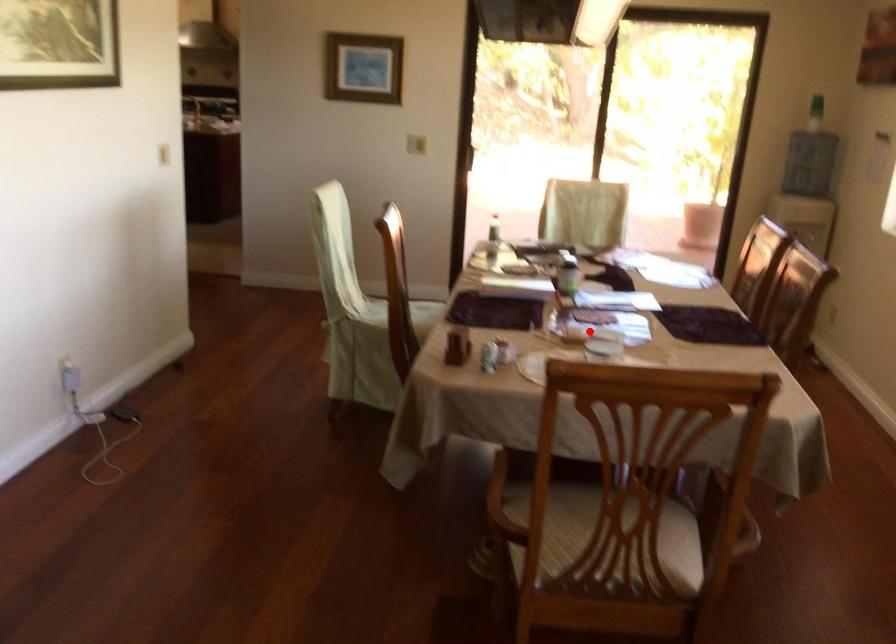
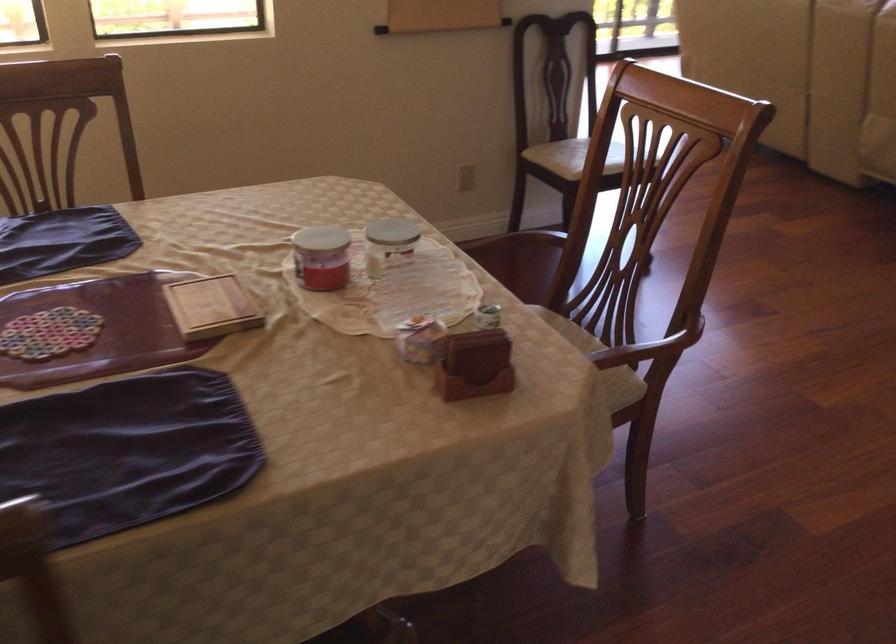
Question: I am providing you with two images of the same scene from different viewpoints. A red point is shown in image1. For the corresponding object point in image2, is it positioned nearer or farther from the camera?

Choices:
 (A) Nearer
 (B) Farther

Answer: (A)